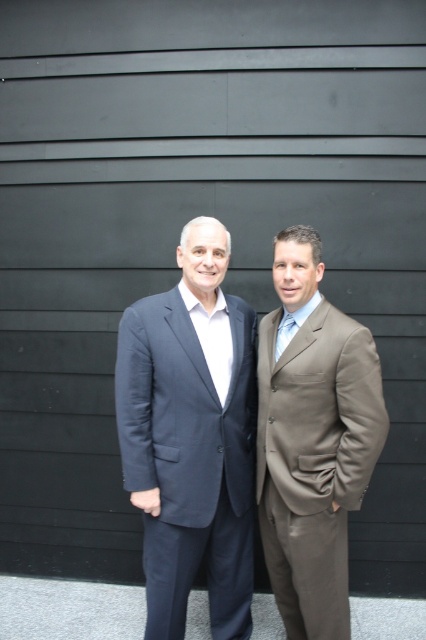
You are an event organizer planning to hang name tags on the matte brown suit at right and the light blue silk tie at center. Since the name tags have different sizes, which object requires a larger name tag?

The matte brown suit at right requires a larger name tag because it has a larger size compared to the light blue silk tie at center.

You are a tailor measuring the distance between two items in the image. The items are the matte blue suit at center and the light blue silk tie at center. The tailor needs to ensure that the distance between them is at least 18 inches for proper fitting adjustments. Is the current distance sufficient?

The distance between the matte blue suit at center and the light blue silk tie at center is 17.37 inches, which is less than the required 18 inches. Therefore, the current distance is not sufficient for proper fitting adjustments.

You are a photographer setting up a shoot in the scene described. You need to ensure that the matte blue suit at center is visible above the light blue silk tie at center in the final photo. Based on their current positions, is this achievable without moving either object?

The matte blue suit at center is positioned under the light blue silk tie at center, so it is not possible to have the matte blue suit at center appear above the light blue silk tie at center without adjusting their positions.